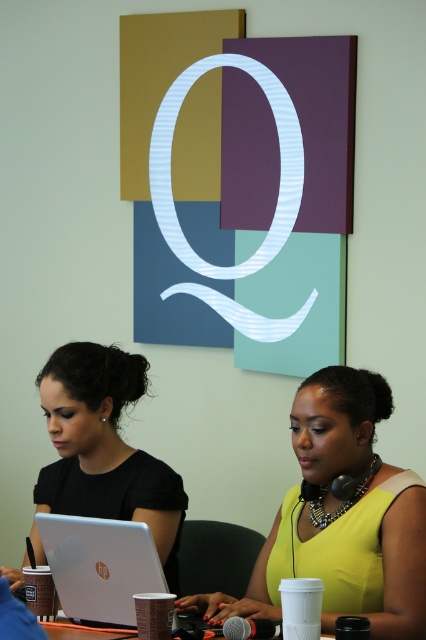
You are organizing a workshop and need to place a 1.2 meter long banner on the table. Given the black matte laptop at left and the white glossy table at lower center, can the banner fit on the table without overlapping either object?

The black matte laptop at left has a larger size compared to white glossy table at lower center. However, the table itself is the surface where the laptop is placed. Since the banner is 1.2 meters long, it might not fit if the table is smaller than that. But according to the description, the laptop is larger than the table, which is impossible. There must be an error in the provided information.

You are standing at the center of the table in the professional setting. You need to reach both the point at [325,499] and the point at [123,520]. Which point should you move towards first if you want to reach the one that is closer to you?

You should move towards point [123,520] first because it is closer to you than point [325,499], which is further away.